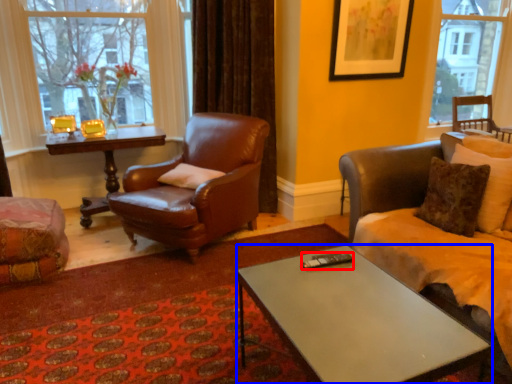
Question: Which object is further to the camera taking this photo, remote control (highlighted by a red box) or coffee table (highlighted by a blue box)?

Choices:
 (A) remote control
 (B) coffee table

Answer: (A)